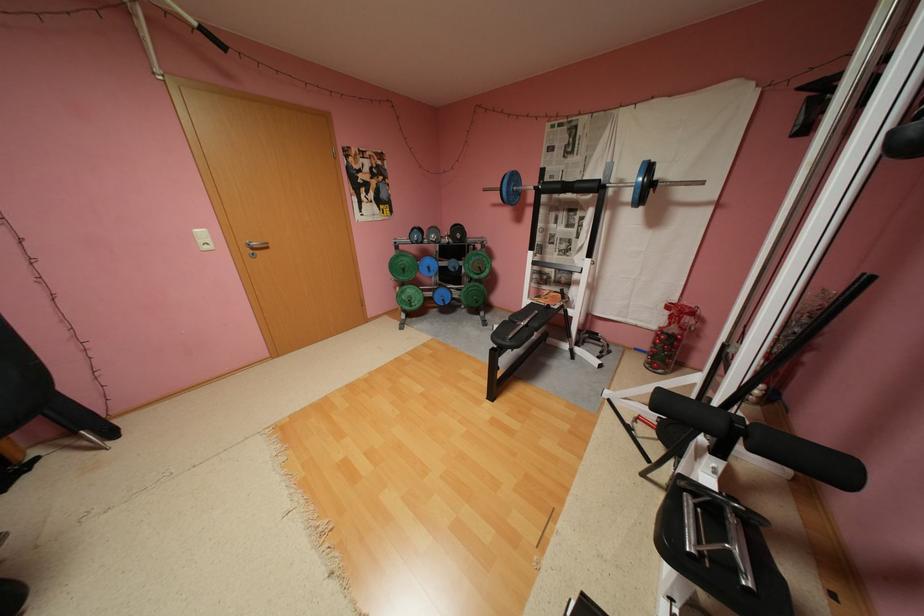
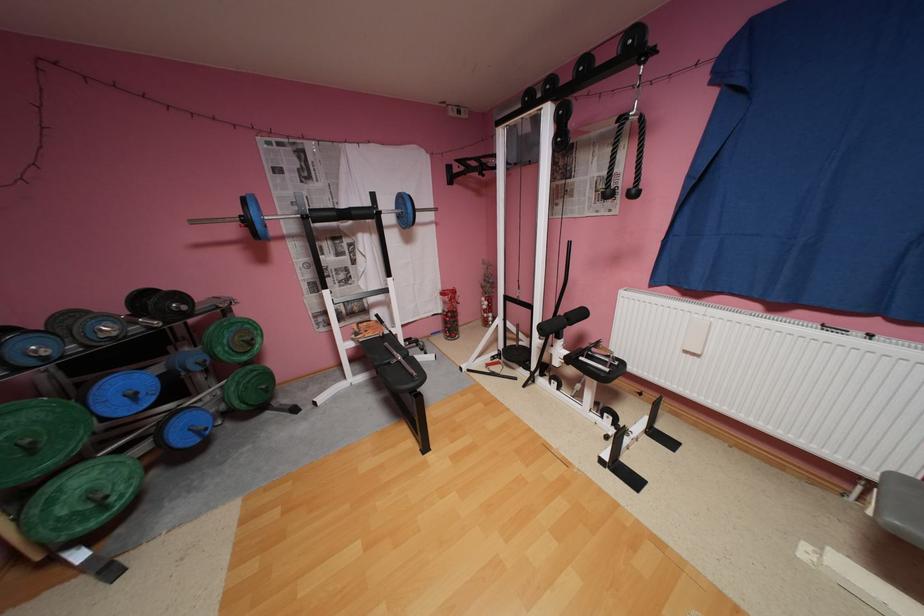
Where in the second image is the point corresponding to [586,185] from the first image?

(362, 213)